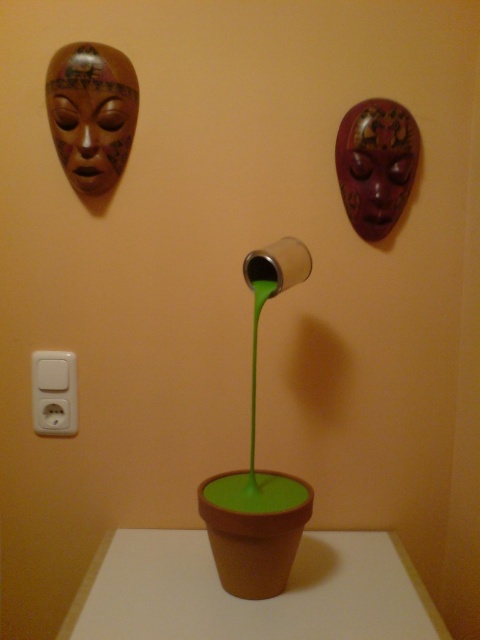
In the scene shown: You are an electrician inspecting the wall. You see the matte brown mask at upper left and the white plastic electric outlet at lower left. Which object has a greater width?

The matte brown mask at upper left has a greater width than the white plastic electric outlet at lower left.